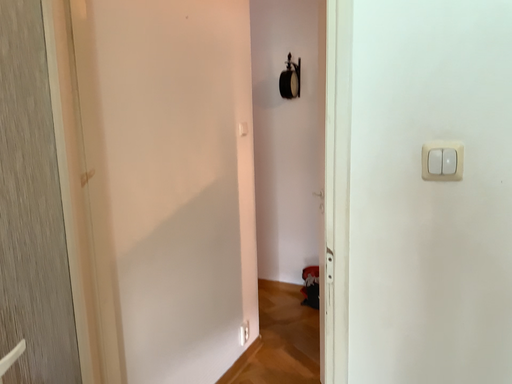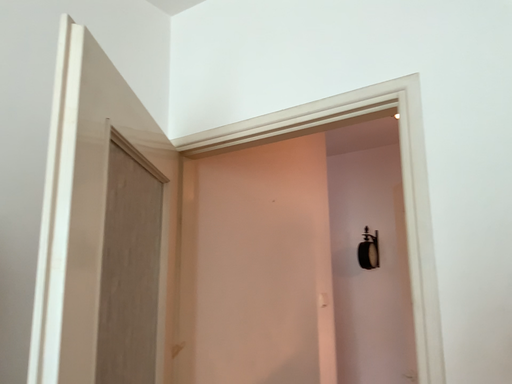
Question: How did the camera likely rotate when shooting the video?

Choices:
 (A) rotated downward
 (B) rotated upward

Answer: (B)